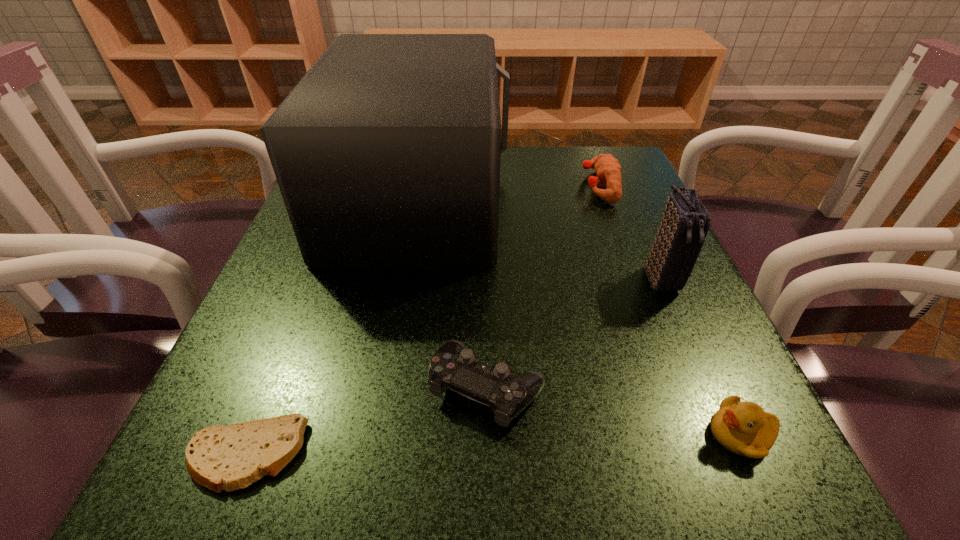
Image resolution: width=960 pixels, height=540 pixels. I want to click on microwave oven, so click(x=387, y=152).

This screenshot has height=540, width=960. I want to click on the fifth shortest object, so click(685, 222).

Locate an element on the screen. puncher is located at coordinates (608, 169).

The image size is (960, 540). In order to click on control in this screenshot , I will do `click(454, 367)`.

You are a GUI agent. You are given a task and a screenshot of the screen. Output one action in this format:
    pyautogui.click(x=<x>, y=<y>)
    Task: Click on the duckling
    The image size is (960, 540).
    Given the screenshot: What is the action you would take?
    pyautogui.click(x=743, y=428)

You are a GUI agent. You are given a task and a screenshot of the screen. Output one action in this format:
    pyautogui.click(x=<x>, y=<y>)
    Task: Click on the shortest object
    
    Given the screenshot: What is the action you would take?
    pyautogui.click(x=218, y=457)

The image size is (960, 540). Identify the location of free region located on the front-facing side of the tallest object. (614, 199).

The image size is (960, 540). Find the location of `free region located 0.280m with the zip open on the second tallest object`. free region located 0.280m with the zip open on the second tallest object is located at coordinates 744,468.

Image resolution: width=960 pixels, height=540 pixels. Find the location of `vacant space located with the gloves of the puncher facing forward`. vacant space located with the gloves of the puncher facing forward is located at coordinates (440, 186).

Image resolution: width=960 pixels, height=540 pixels. I want to click on free space located with the gloves of the puncher facing forward, so click(538, 186).